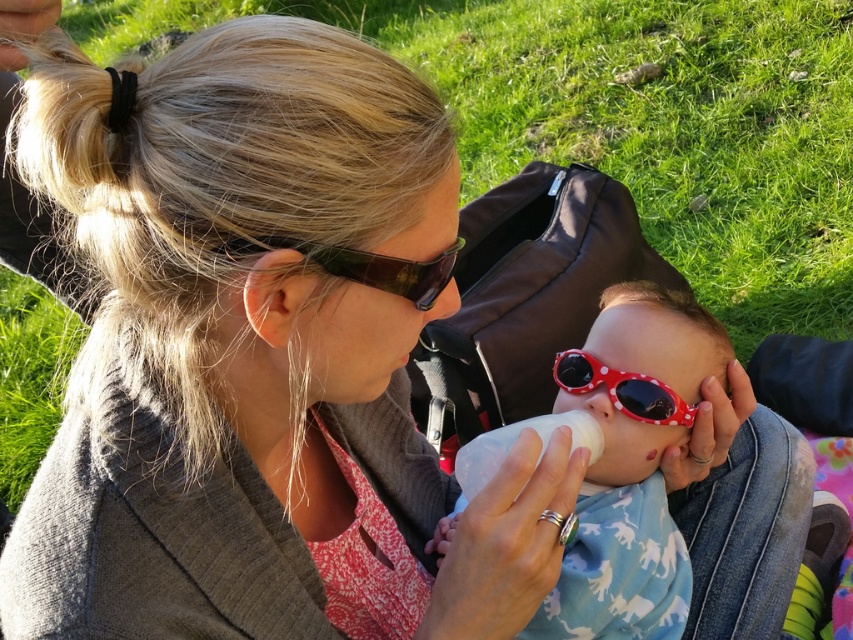
You are a swimmer who wants to choose a pair of goggles from the two available. The black plastic goggles at upper center and the polka dot plastic goggles at center are both on a table. If you look from the left side of the table, which pair of goggles would you see first?

The black plastic goggles at upper center is to the left of the polka dot plastic goggles at center, so when looking from the left side of the table, you would see the black plastic goggles at upper center first.

You are a photographer trying to capture a clear shot of both the polka dot plastic sunglasses at center and the black plastic goggles at upper center. Since you can only focus on one object at a time, which object should you focus on first to ensure the other is still in the frame?

You should focus on the black plastic goggles at upper center first because the polka dot plastic sunglasses at center is to the right of it, so adjusting focus between them would keep both in frame.

You are a photographer trying to capture a clear shot of the polka dot plastic goggles at center. However, the polka dot plastic sunglasses at center is blocking your view. Can you determine if the goggles are visible behind the sunglasses?

The polka dot plastic sunglasses at center is in front of the polka dot plastic goggles at center, so the goggles are not fully visible behind the sunglasses.